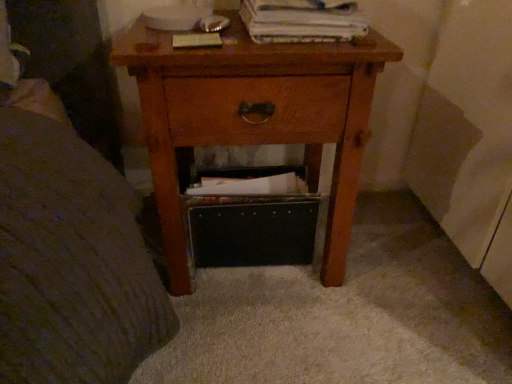
Question: Is matte brown paperback book at upper center, the second paperback book from the right, situated inside wooden nightstand at center or outside?

Choices:
 (A) outside
 (B) inside

Answer: (B)

Question: Looking at their shapes, would you say matte brown paperback book at upper center, which is the 1th paperback book from left to right, is wider or thinner than wooden nightstand at center?

Choices:
 (A) wide
 (B) thin

Answer: (B)

Question: Considering the real-world distances, which object is closest to the matte brown paperback book at upper center, which is the 1th paperback book from left to right?

Choices:
 (A) white paper at upper center, arranged as the first paperback book when viewed from the right
 (B) wooden nightstand at center

Answer: (A)

Question: Estimate the real-world distances between objects in this image. Which object is farther from the matte brown paperback book at upper center, which is the 1th paperback book from left to right?

Choices:
 (A) wooden nightstand at center
 (B) white paper at upper center, the second paperback book viewed from the left

Answer: (A)